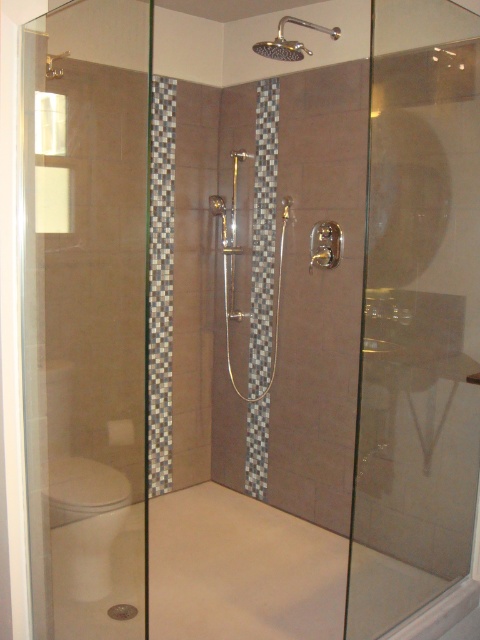
You are a bathroom designer planning to install a new shelf between the transparent glass screen door at left and the transparent glass screen door at right. The shelf requires 1.2 meters of space between them. Based on the current setup, will there be enough space for the shelf?

The transparent glass screen door at left is 1.14 meters away from transparent glass screen door at right. Since the required space for the shelf is 1.2 meters, there isn not enough space between them to install the shelf.

You are standing in the bathroom and want to enter the shower area. The transparent glass screen door at left is represented by point (85, 316). Is the door open or closed?

The transparent glass screen door at left is represented by point (85, 316). Since the description mentions the shower area is enclosed by a glass door, the door is likely closed to enclose the shower area.

You are a bathroom designer and need to place a new 1.2 meter wide vanity cabinet in this bathroom. The transparent glass screen door at left and the white glossy toilet bowl at lower left are already present. Which object has a wider width to consider for spacing?

The transparent glass screen door at left has a wider width than the white glossy toilet bowl at lower left, so you should consider its width for spacing when placing the vanity cabinet.